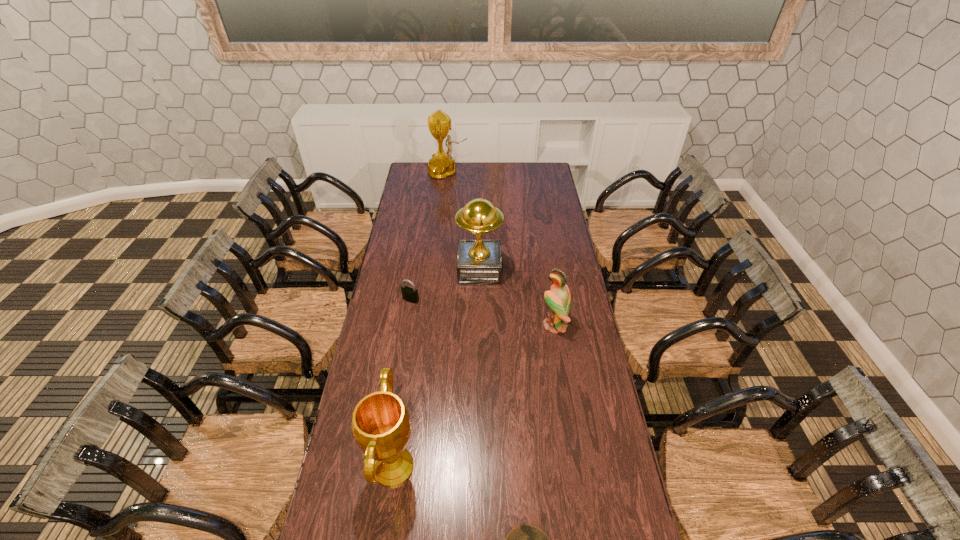
Where is `the farthest award`? the farthest award is located at coordinates (442, 165).

Locate an element on the screen. The image size is (960, 540). the second farthest object is located at coordinates click(479, 260).

Find the location of a particular element. The height and width of the screenshot is (540, 960). the second nearest object is located at coordinates pyautogui.click(x=380, y=424).

Where is `the fourth farthest object`? the fourth farthest object is located at coordinates (558, 299).

Locate an element on the screen. This screenshot has width=960, height=540. the fourth tallest object is located at coordinates (558, 299).

Image resolution: width=960 pixels, height=540 pixels. What are the coordinates of `the second shortest object` in the screenshot? It's located at (409, 294).

The image size is (960, 540). Identify the location of padlock. (409, 294).

The image size is (960, 540). Find the location of `vacant space located 0.290m on the front side of the farthest award`. vacant space located 0.290m on the front side of the farthest award is located at coordinates (516, 172).

Where is `vacant area situated on the front-facing side of the second farthest award`? This screenshot has height=540, width=960. vacant area situated on the front-facing side of the second farthest award is located at coordinates (555, 270).

This screenshot has height=540, width=960. I want to click on vacant space located on the front-facing side of the nearest award, so click(x=511, y=467).